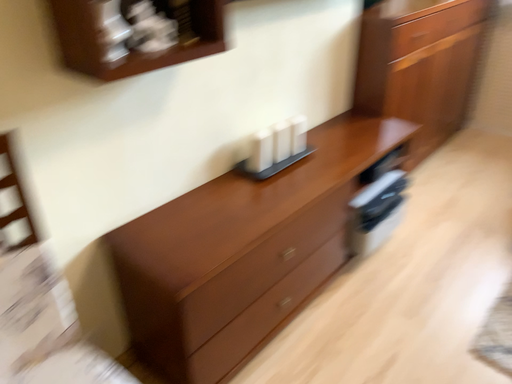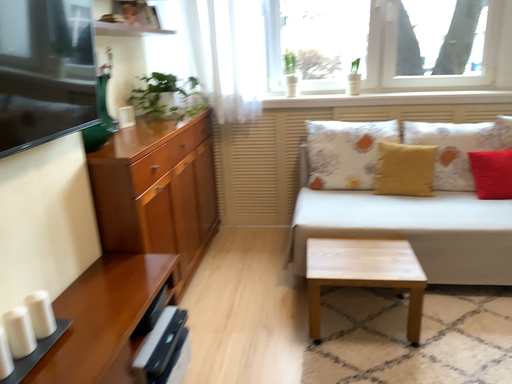
Question: Which way did the camera rotate in the video?

Choices:
 (A) rotated downward
 (B) rotated upward

Answer: (B)